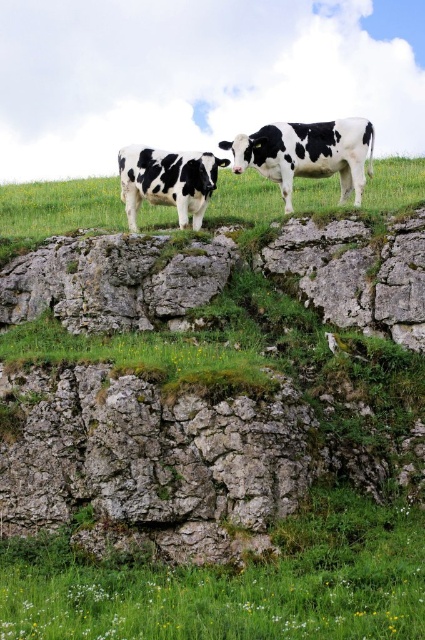
Question: Which point appears closest to the camera in this image?

Choices:
 (A) (322, 128)
 (B) (122, 192)

Answer: (A)

Question: Is black-and-white cow at center smaller than black-and-white spotted cow at upper left?

Choices:
 (A) no
 (B) yes

Answer: (A)

Question: Among these points, which one is farthest from the camera?

Choices:
 (A) (359, 131)
 (B) (130, 161)

Answer: (B)

Question: Is black-and-white cow at center smaller than black-and-white spotted cow at upper left?

Choices:
 (A) no
 (B) yes

Answer: (A)

Question: Which point is farther to the camera?

Choices:
 (A) black-and-white spotted cow at upper left
 (B) black-and-white cow at center

Answer: (A)

Question: Observing the image, what is the correct spatial positioning of black-and-white cow at center in reference to black-and-white spotted cow at upper left?

Choices:
 (A) right
 (B) left

Answer: (A)